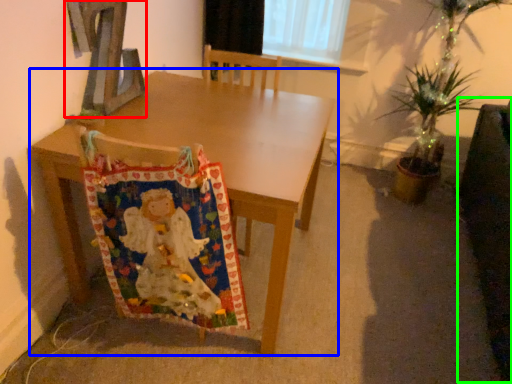
Question: Which is nearer to the alphabet (highlighted by a red box)? table (highlighted by a blue box) or swivel chair (highlighted by a green box).

Choices:
 (A) table
 (B) swivel chair

Answer: (A)